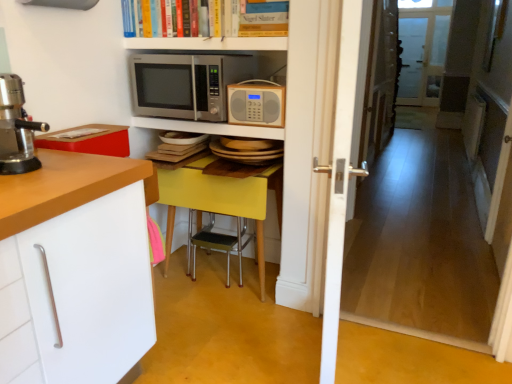
Locate an element on the screen. The image size is (512, 384). unoccupied space behind wooden floor at center is located at coordinates (388, 302).